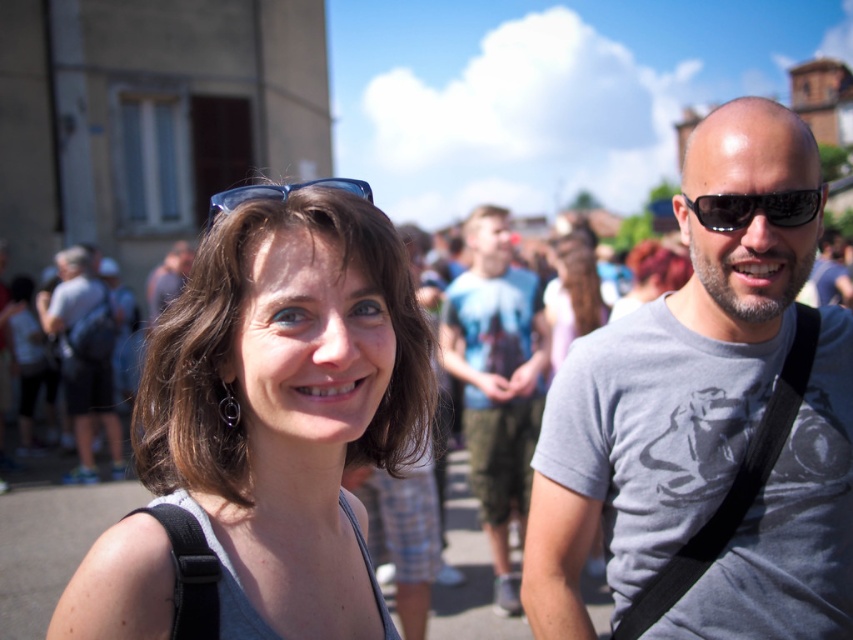
Question: Is gray matte t-shirt at right thinner than light blue t-shirt at center?

Choices:
 (A) yes
 (B) no

Answer: (B)

Question: Which is nearer to the gray matte t-shirt at right?

Choices:
 (A) matte black backpack at left
 (B) light blue t-shirt at center

Answer: (B)

Question: In this image, where is gray matte t-shirt at right located relative to black plastic sunglasses at right?

Choices:
 (A) right
 (B) left

Answer: (B)

Question: Is matte gray tank top at center smaller than matte gray shirt at center?

Choices:
 (A) yes
 (B) no

Answer: (A)

Question: Which point is closer to the camera?

Choices:
 (A) blue plastic sunglasses at upper center
 (B) black plastic sunglasses at right

Answer: (A)

Question: Which point is closer to the camera?

Choices:
 (A) (368, 406)
 (B) (112, 444)

Answer: (A)